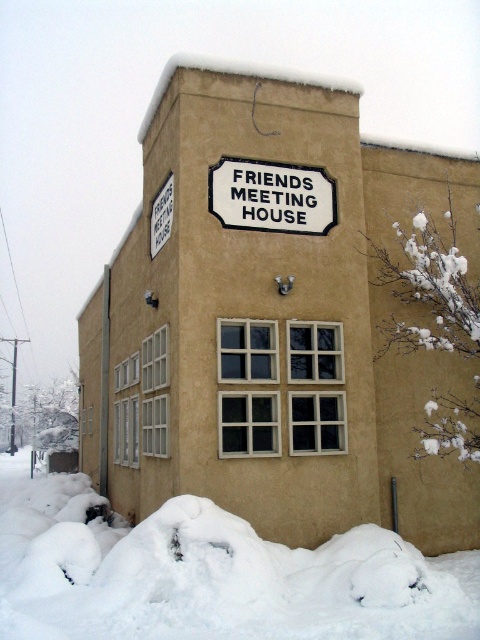
Describe the element at coordinates (210, 573) in the screenshot. I see `white fluffy snow at lower center` at that location.

Between white fluffy snow at lower center and white enamel sign at center, which one appears on the left side from the viewer's perspective?

white fluffy snow at lower center

Locate an element on the screen. The image size is (480, 640). white fluffy snow at lower center is located at coordinates click(210, 573).